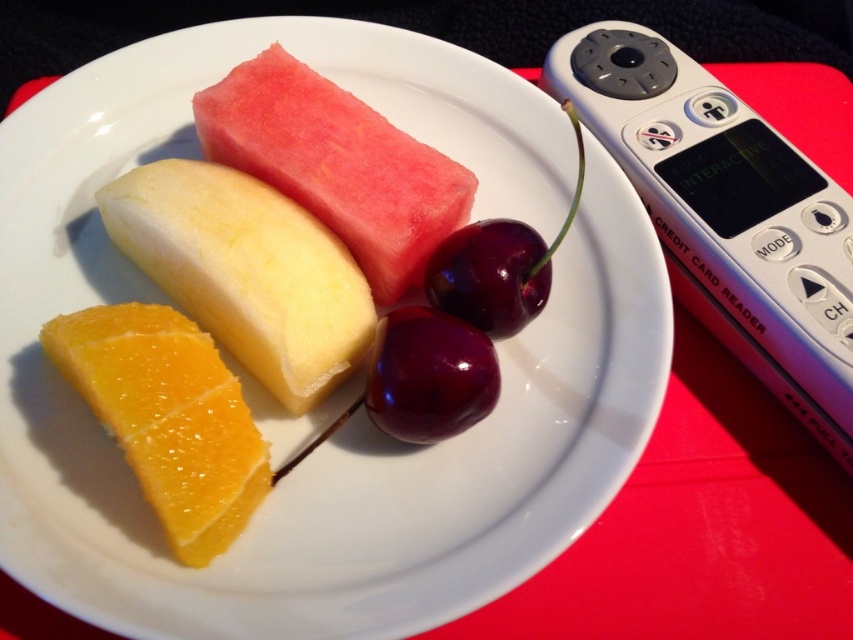
Question: Which object is closer to the camera taking this photo?

Choices:
 (A) juicy orange at lower left
 (B) white plastic remote at right
 (C) shiny dark red plum at center
 (D) yellow matte apple at center

Answer: (A)

Question: Is juicy orange at lower left further to the viewer compared to shiny dark red plum at center?

Choices:
 (A) yes
 (B) no

Answer: (B)

Question: Does red matte watermelon at center have a larger size compared to shiny dark red plum at center?

Choices:
 (A) yes
 (B) no

Answer: (A)

Question: Is yellow matte apple at center to the left of red matte watermelon at center from the viewer's perspective?

Choices:
 (A) yes
 (B) no

Answer: (A)

Question: Among these points, which one is farthest from the camera?

Choices:
 (A) (373, 352)
 (B) (840, 246)
 (C) (131, 305)
 (D) (286, 192)

Answer: (D)

Question: Which point appears closest to the camera in this image?

Choices:
 (A) (175, 534)
 (B) (640, 125)
 (C) (230, 124)
 (D) (445, 333)

Answer: (A)